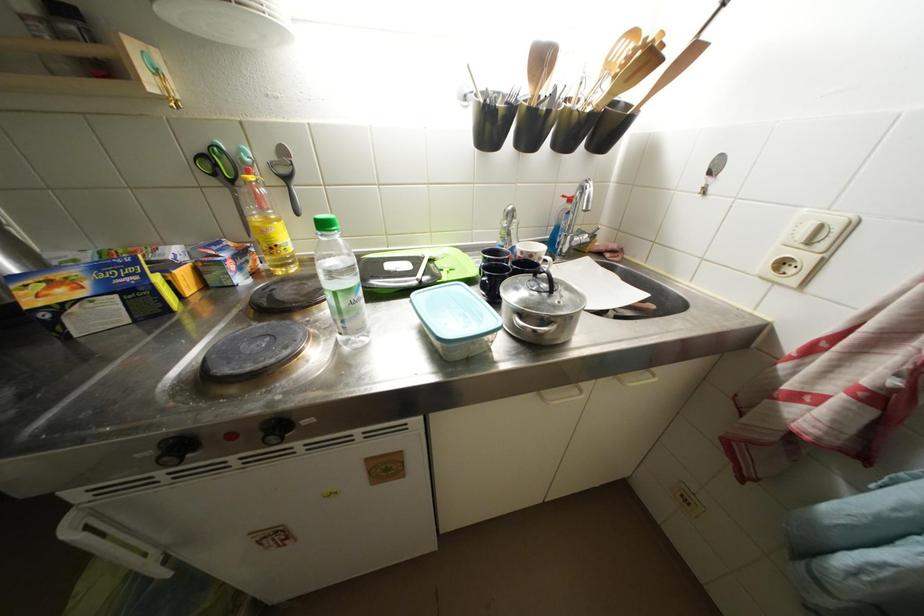
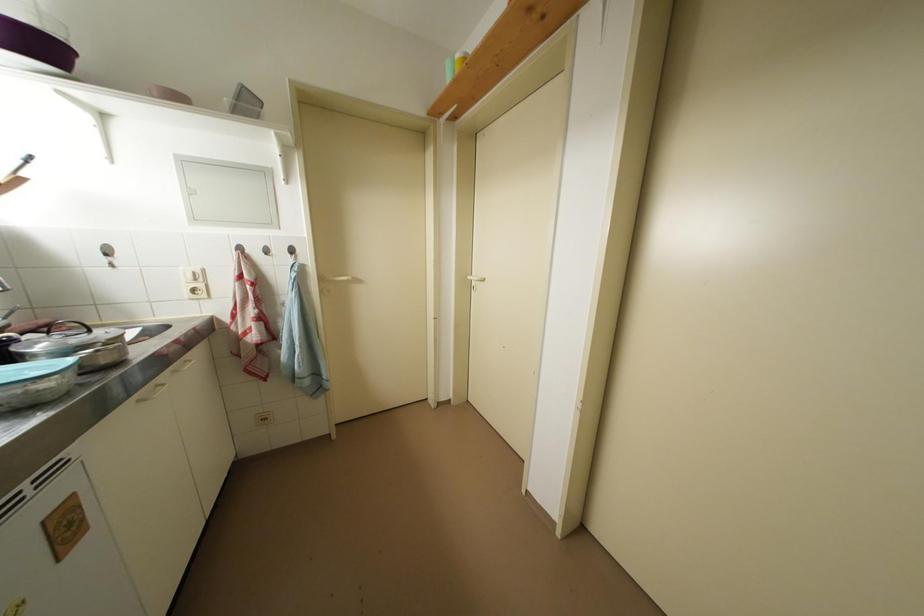
Find the pixel in the second image that matches point (827, 232) in the first image.

(201, 277)